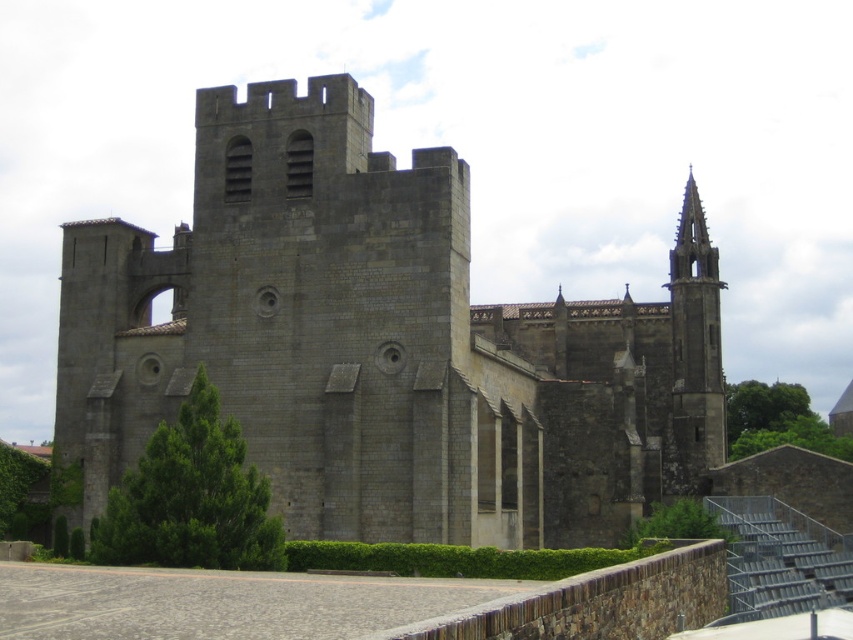
In the scene shown: Which of these two, gray stone castle at center or smooth gray spire at upper right, stands taller?

With more height is smooth gray spire at upper right.

Is gray stone castle at center shorter than smooth gray spire at upper right?

Indeed, gray stone castle at center has a lesser height compared to smooth gray spire at upper right.

The image size is (853, 640). What do you see at coordinates (381, 344) in the screenshot?
I see `gray stone castle at center` at bounding box center [381, 344].

Where is `gray stone castle at center`? gray stone castle at center is located at coordinates (381, 344).